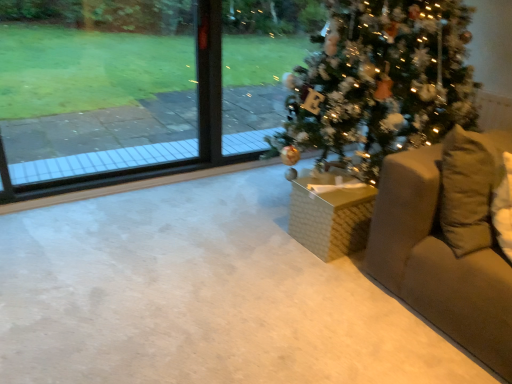
This screenshot has width=512, height=384. I want to click on transparent glass window at upper left, so click(x=98, y=97).

Locate an element on the screen. The image size is (512, 384). shiny green christmas tree at center is located at coordinates (381, 82).

I want to click on transparent glass window at upper left, so click(x=98, y=97).

Are transparent glass window at upper left and beige fabric couch at right, the first furniture viewed from the right, far apart?

Yes, transparent glass window at upper left and beige fabric couch at right, the first furniture viewed from the right, are located far from each other.

Identify the location of window screen lying above the beige fabric couch at right, the first furniture viewed from the right (from the image's perspective). (98, 97).

Is transparent glass window at upper left oriented away from beige fabric couch at right, the 2th furniture positioned from the left?

No, transparent glass window at upper left is not facing the opposite direction of beige fabric couch at right, the 2th furniture positioned from the left.

This screenshot has width=512, height=384. Identify the location of window screen on the left of white woven basket at center, the 2th furniture from the right. tap(98, 97).

Which is correct: white woven basket at center, the 2th furniture from the right, is inside transparent glass window at upper left, or outside of it?

The correct answer is: outside.

From the image's perspective, does white woven basket at center, the first furniture from the left, appear higher than transparent glass window at upper left?

No, from the image's perspective, white woven basket at center, the first furniture from the left, is not over transparent glass window at upper left.

Is white woven basket at center, the 2th furniture from the right, at the right side of transparent glass window at upper left?

Yes, white woven basket at center, the 2th furniture from the right, is to the right of transparent glass window at upper left.

Which is closer, (280, 134) or (18, 141)?

The point (280, 134) is more forward.

Where is `christmas tree lying in front of the transparent glass window at upper left`? This screenshot has height=384, width=512. christmas tree lying in front of the transparent glass window at upper left is located at coordinates (381, 82).

Does shiny green christmas tree at center lie behind transparent glass window at upper left?

No, it is not.

From the picture: From their relative heights in the image, would you say shiny green christmas tree at center is taller or shorter than transparent glass window at upper left?

shiny green christmas tree at center is taller than transparent glass window at upper left.

Can you confirm if white woven basket at center, the first furniture from the left, is thinner than shiny green christmas tree at center?

Indeed, white woven basket at center, the first furniture from the left, has a lesser width compared to shiny green christmas tree at center.

Does white woven basket at center, the 2th furniture from the right, turn towards shiny green christmas tree at center?

Yes, white woven basket at center, the 2th furniture from the right, is oriented towards shiny green christmas tree at center.

Considering the positions of point (328, 255) and point (469, 95), is point (328, 255) closer or farther from the camera than point (469, 95)?

Point (328, 255).

From the image's perspective, is white woven basket at center, the 2th furniture from the right, located beneath shiny green christmas tree at center?

Correct, white woven basket at center, the 2th furniture from the right, appears lower than shiny green christmas tree at center in the image.

From a real-world perspective, which object stands above the other?

In real-world perspective, shiny green christmas tree at center is above.

Are shiny green christmas tree at center and beige fabric couch at right, the 2th furniture positioned from the left, located far from each other?

No, shiny green christmas tree at center is not far from beige fabric couch at right, the 2th furniture positioned from the left.

Is shiny green christmas tree at center looking in the opposite direction of beige fabric couch at right, the 2th furniture positioned from the left?

No, shiny green christmas tree at center is not facing the opposite direction of beige fabric couch at right, the 2th furniture positioned from the left.

Is shiny green christmas tree at center not inside white woven basket at center, the first furniture from the left?

shiny green christmas tree at center lies outside white woven basket at center, the first furniture from the left,'s area.

You are a GUI agent. You are given a task and a screenshot of the screen. Output one action in this format:
    pyautogui.click(x=<x>, y=<y>)
    Task: Click on the christmas tree located on the right of white woven basket at center, the first furniture from the left
    
    Given the screenshot: What is the action you would take?
    pyautogui.click(x=381, y=82)

Relative to white woven basket at center, the first furniture from the left, is shiny green christmas tree at center in front or behind?

shiny green christmas tree at center is in front of white woven basket at center, the first furniture from the left.

This screenshot has height=384, width=512. I want to click on furniture that is behind the beige fabric couch at right, the 2th furniture positioned from the left, so click(330, 213).

Is white woven basket at center, the first furniture from the left, bigger or smaller than beige fabric couch at right, the first furniture viewed from the right?

Clearly, white woven basket at center, the first furniture from the left, is smaller in size than beige fabric couch at right, the first furniture viewed from the right.

Who is more distant, white woven basket at center, the 2th furniture from the right, or beige fabric couch at right, the 2th furniture positioned from the left?

white woven basket at center, the 2th furniture from the right, is behind.

Is white woven basket at center, the 2th furniture from the right, oriented away from beige fabric couch at right, the 2th furniture positioned from the left?

No.

You are a GUI agent. You are given a task and a screenshot of the screen. Output one action in this format:
    pyautogui.click(x=<x>, y=<y>)
    Task: Click on the window screen that is behind the beige fabric couch at right, the first furniture viewed from the right
    
    Given the screenshot: What is the action you would take?
    pyautogui.click(x=98, y=97)

Find the location of a particular element. the 1st furniture to the right when counting from the transparent glass window at upper left is located at coordinates (330, 213).

Looking at the image, which one is located further to beige fabric couch at right, the first furniture viewed from the right, transparent glass window at upper left or white woven basket at center, the first furniture from the left?

transparent glass window at upper left is positioned further to the anchor beige fabric couch at right, the first furniture viewed from the right.

Estimate the real-world distances between objects in this image. Which object is closer to shiny green christmas tree at center, white woven basket at center, the 2th furniture from the right, or transparent glass window at upper left?

The object closer to shiny green christmas tree at center is white woven basket at center, the 2th furniture from the right.

Looking at the image, which one is located further to shiny green christmas tree at center, transparent glass window at upper left or beige fabric couch at right, the first furniture viewed from the right?

transparent glass window at upper left lies further to shiny green christmas tree at center than the other object.

Based on their spatial positions, is transparent glass window at upper left or shiny green christmas tree at center closer to white woven basket at center, the first furniture from the left?

shiny green christmas tree at center is positioned closer to the anchor white woven basket at center, the first furniture from the left.

From the image, which object appears to be farther from shiny green christmas tree at center, white woven basket at center, the first furniture from the left, or beige fabric couch at right, the 2th furniture positioned from the left?

The object further to shiny green christmas tree at center is beige fabric couch at right, the 2th furniture positioned from the left.

When comparing their distances from transparent glass window at upper left, does beige fabric couch at right, the first furniture viewed from the right, or shiny green christmas tree at center seem further?

beige fabric couch at right, the first furniture viewed from the right, is positioned further to the anchor transparent glass window at upper left.

From the image, which object appears to be farther from shiny green christmas tree at center, beige fabric couch at right, the first furniture viewed from the right, or transparent glass window at upper left?

transparent glass window at upper left.

Estimate the real-world distances between objects in this image. Which object is further from shiny green christmas tree at center, beige fabric couch at right, the 2th furniture positioned from the left, or white woven basket at center, the 2th furniture from the right?

beige fabric couch at right, the 2th furniture positioned from the left, is positioned further to the anchor shiny green christmas tree at center.

At what (x,y) coordinates should I click in order to perform the action: click on furniture located between transparent glass window at upper left and beige fabric couch at right, the first furniture viewed from the right, in the left-right direction. Please return your answer as a coordinate pair (x, y). Looking at the image, I should click on (330, 213).

Locate an element on the screen. This screenshot has height=384, width=512. christmas tree between beige fabric couch at right, the 2th furniture positioned from the left, and white woven basket at center, the 2th furniture from the right, along the z-axis is located at coordinates (381, 82).

I want to click on furniture situated between transparent glass window at upper left and shiny green christmas tree at center from left to right, so click(330, 213).

At what (x,y) coordinates should I click in order to perform the action: click on christmas tree between transparent glass window at upper left and beige fabric couch at right, the 2th furniture positioned from the left, from left to right. Please return your answer as a coordinate pair (x, y). This screenshot has height=384, width=512. Looking at the image, I should click on (381, 82).